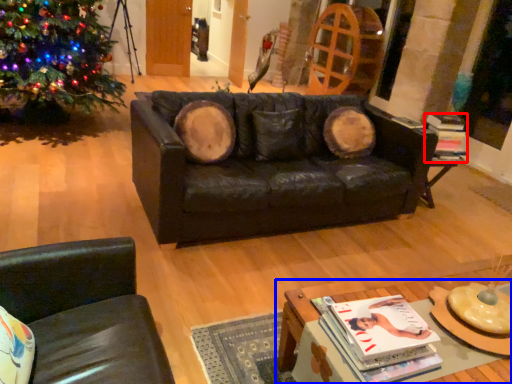
Question: Which point is further to the camera, magazine (highlighted by a red box) or table (highlighted by a blue box)?

Choices:
 (A) magazine
 (B) table

Answer: (A)